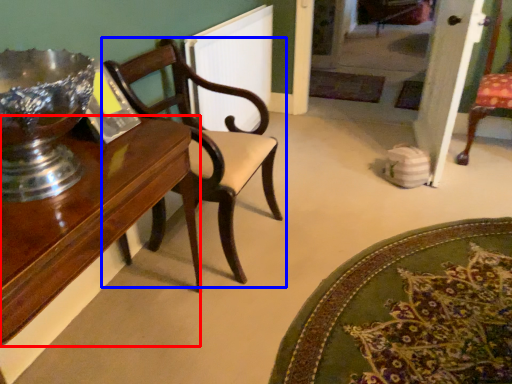
Question: Which point is further to the camera, table (highlighted by a red box) or chair (highlighted by a blue box)?

Choices:
 (A) table
 (B) chair

Answer: (B)